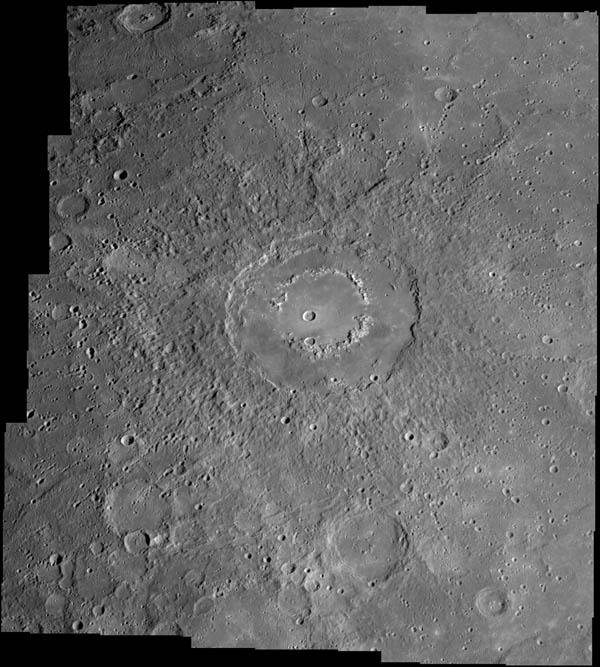
The height and width of the screenshot is (667, 600). I want to click on black and white picture, so click(x=376, y=425).